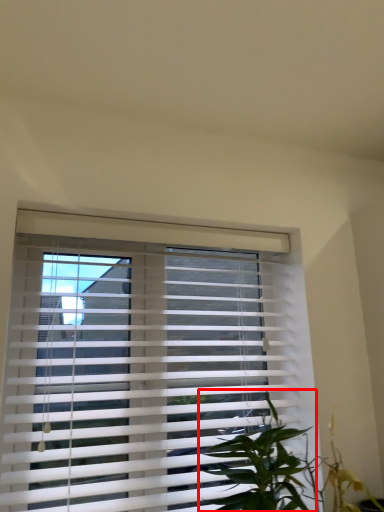
Question: In this image, where is vegetation (annotated by the red box) located relative to window blind?

Choices:
 (A) left
 (B) right

Answer: (B)